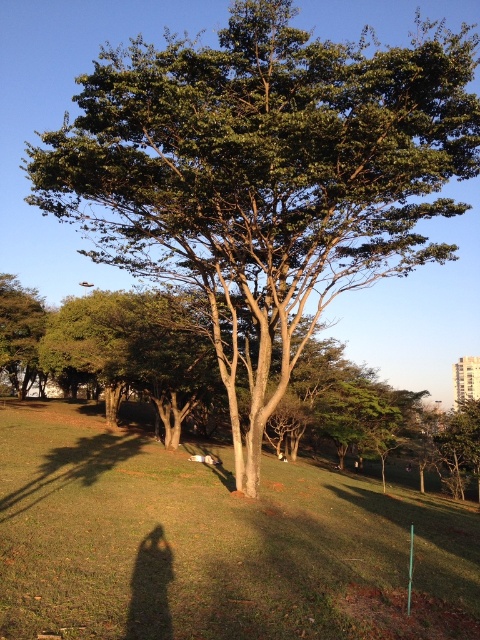
You are a gardener holding a 2 meter long hose. You want to water the green grassy at center. Can you reach it from where you are standing?

The distance between you and the green grassy at center is 5.69 meters, so the 2 meter long hose is not long enough to reach it. You will need a longer hose or move closer.

You want to place a picnic blanket in the green grassy area at center. The blanket is 2 meters wide. Is there enough space between the green grassy at center and the green leafy tree at left to fit the blanket?

The green grassy at center might be wider than the green leafy tree at left, so there could be sufficient space to fit a 2 meter wide picnic blanket between them.